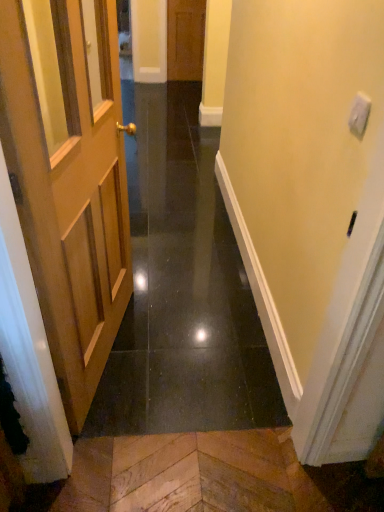
Question: Is wooden door at left located outside light brown wooden door at left, acting as the 1th door starting from the bottom?

Choices:
 (A) yes
 (B) no

Answer: (A)

Question: Is wooden door at left oriented towards light brown wooden door at left, which ranks as the 2th door in back-to-front order?

Choices:
 (A) yes
 (B) no

Answer: (B)

Question: Would you consider wooden door at left to be distant from light brown wooden door at left, acting as the 1th door starting from the bottom?

Choices:
 (A) no
 (B) yes

Answer: (A)

Question: Is wooden door at left shorter than light brown wooden door at left, the second door from the top?

Choices:
 (A) yes
 (B) no

Answer: (A)

Question: Does wooden door at left have a greater height compared to light brown wooden door at left, the 1th door from the front?

Choices:
 (A) no
 (B) yes

Answer: (A)

Question: Does wooden door at left lie in front of light brown wooden door at left, the second door from the top?

Choices:
 (A) yes
 (B) no

Answer: (B)

Question: Would you say wooden door at left is part of light brown wooden door at left, the second door from the top,'s contents?

Choices:
 (A) no
 (B) yes

Answer: (A)

Question: Does light brown wooden door at left, the second door from the top, turn towards wooden door at left?

Choices:
 (A) no
 (B) yes

Answer: (A)

Question: Is light brown wooden door at left, the second door from the top, looking in the opposite direction of wooden door at left?

Choices:
 (A) no
 (B) yes

Answer: (A)

Question: From a real-world perspective, is light brown wooden door at left, the 1th door from the front, over wooden door at left?

Choices:
 (A) no
 (B) yes

Answer: (B)

Question: From the image's perspective, is light brown wooden door at left, acting as the 1th door starting from the bottom, above wooden door at left?

Choices:
 (A) yes
 (B) no

Answer: (B)

Question: Does light brown wooden door at left, which ranks as the 2th door in back-to-front order, touch wooden door at left?

Choices:
 (A) yes
 (B) no

Answer: (B)

Question: Considering the relative sizes of wooden door at center, placed as the 1th door when sorted from back to front, and light brown wooden door at left, acting as the 1th door starting from the bottom, in the image provided, is wooden door at center, placed as the 1th door when sorted from back to front, smaller than light brown wooden door at left, acting as the 1th door starting from the bottom,?

Choices:
 (A) yes
 (B) no

Answer: (A)